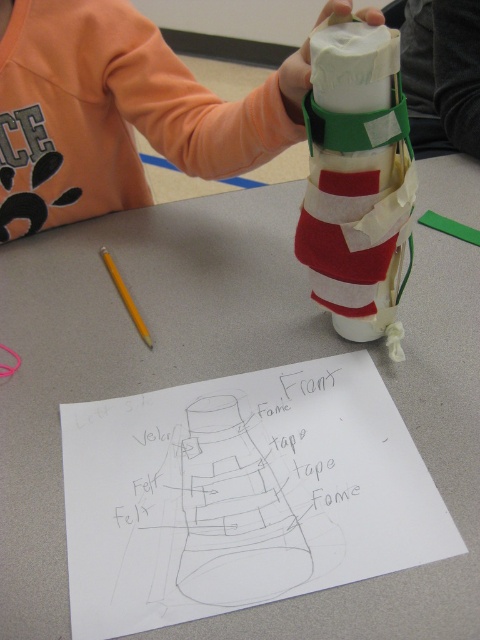
Who is higher up, white matte paper towel roll at center or matte felt wrapped cylinder at center?

white matte paper towel roll at center

Which is below, white matte paper towel roll at center or matte felt wrapped cylinder at center?

Positioned lower is matte felt wrapped cylinder at center.

At what (x,y) coordinates should I click in order to perform the action: click on white matte paper towel roll at center. Please return your answer as a coordinate pair (x, y). The width and height of the screenshot is (480, 640). Looking at the image, I should click on (117, 113).

Between matte felt wrapped cylinder at center and yellow wood pencil at left, which one is positioned lower?

yellow wood pencil at left

Can you confirm if matte felt wrapped cylinder at center is positioned below yellow wood pencil at left?

Incorrect, matte felt wrapped cylinder at center is not positioned below yellow wood pencil at left.

Image resolution: width=480 pixels, height=640 pixels. Identify the location of matte felt wrapped cylinder at center. 358,180.

Where is `matte felt wrapped cylinder at center`? matte felt wrapped cylinder at center is located at coordinates (358, 180).

Between point (36, 228) and point (111, 280), which one is positioned in front?

Positioned in front is point (111, 280).

Can you confirm if white matte paper towel roll at center is positioned to the left of yellow wood pencil at left?

In fact, white matte paper towel roll at center is to the right of yellow wood pencil at left.

Between point (98, 157) and point (108, 269), which one is positioned in front?

Point (108, 269) is in front.

What are the coordinates of `white matte paper towel roll at center` in the screenshot? It's located at (117, 113).